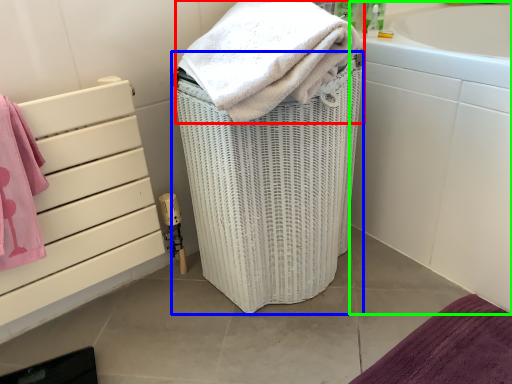
Question: Based on their relative distances, which object is farther from towel (highlighted by a red box)? Choose from basket container (highlighted by a blue box) and bath (highlighted by a green box).

Choices:
 (A) basket container
 (B) bath

Answer: (B)